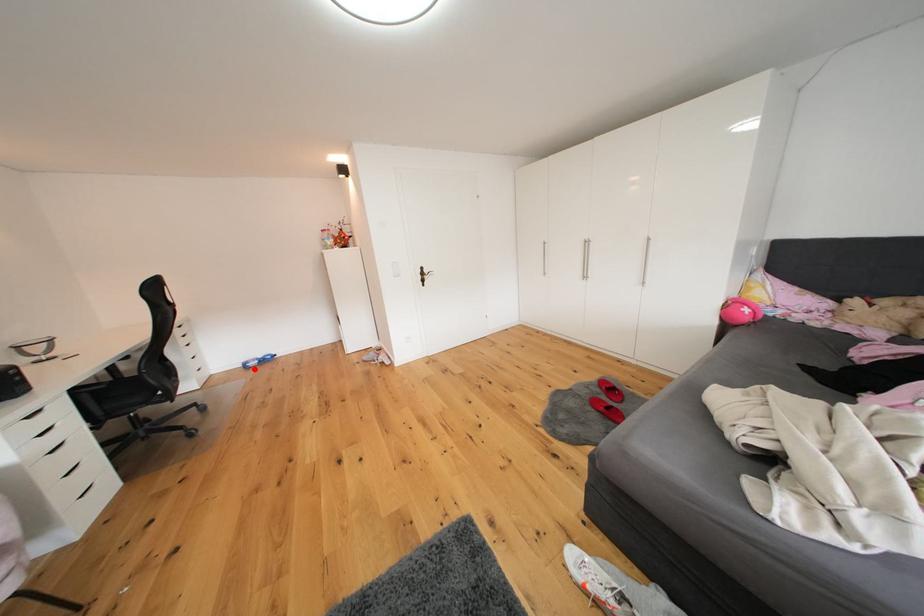
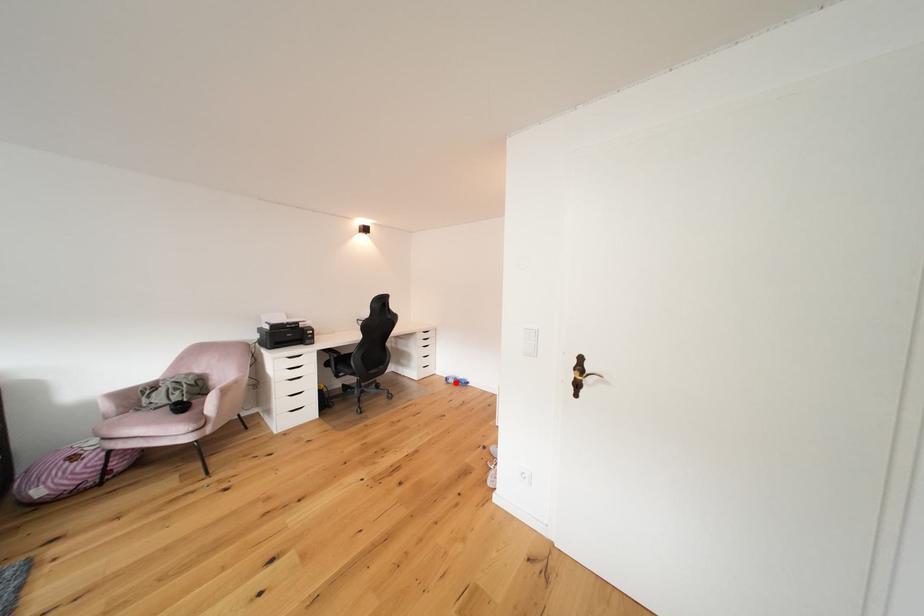
I am providing you with two images of the same scene from different viewpoints. A red point is marked on the first image and another point is marked on the second image. Are the points marked in image1 and image2 representing the same 3D position?

Yes